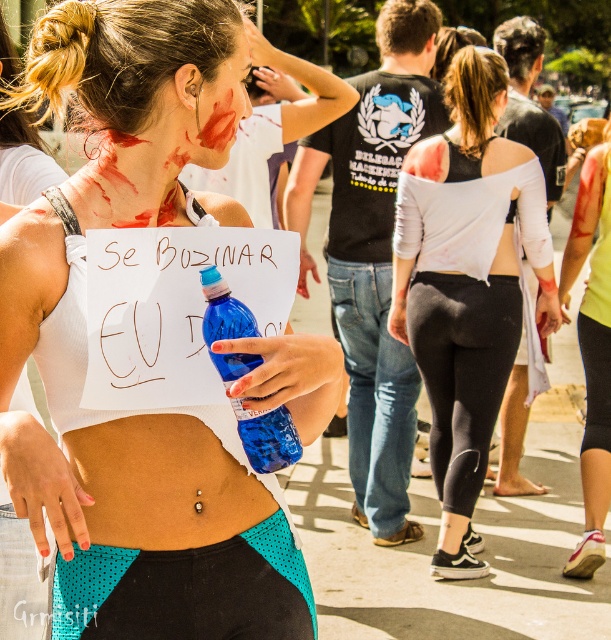
Question: Estimate the real-world distances between objects in this image. Which object is farther from the matte white tank top at center?

Choices:
 (A) teal mesh shorts at lower center
 (B) smooth skin belly at center
 (C) yellow fabric shirt at center

Answer: (C)

Question: Estimate the real-world distances between objects in this image. Which object is farther from the blue plastic bottle at center?

Choices:
 (A) white matte tank top at center
 (B) matte plastic face at center

Answer: (A)

Question: Does yellow fabric shirt at center come in front of matte plastic face at center?

Choices:
 (A) no
 (B) yes

Answer: (A)

Question: Is yellow fabric shirt at center below blue plastic bottle at center?

Choices:
 (A) no
 (B) yes

Answer: (A)

Question: Which object is positioned farthest from the smooth skin belly at center?

Choices:
 (A) white matte tank top at center
 (B) teal mesh shorts at lower center
 (C) yellow fabric shirt at center

Answer: (C)

Question: Is teal mesh shorts at lower center wider than yellow fabric shirt at center?

Choices:
 (A) no
 (B) yes

Answer: (B)